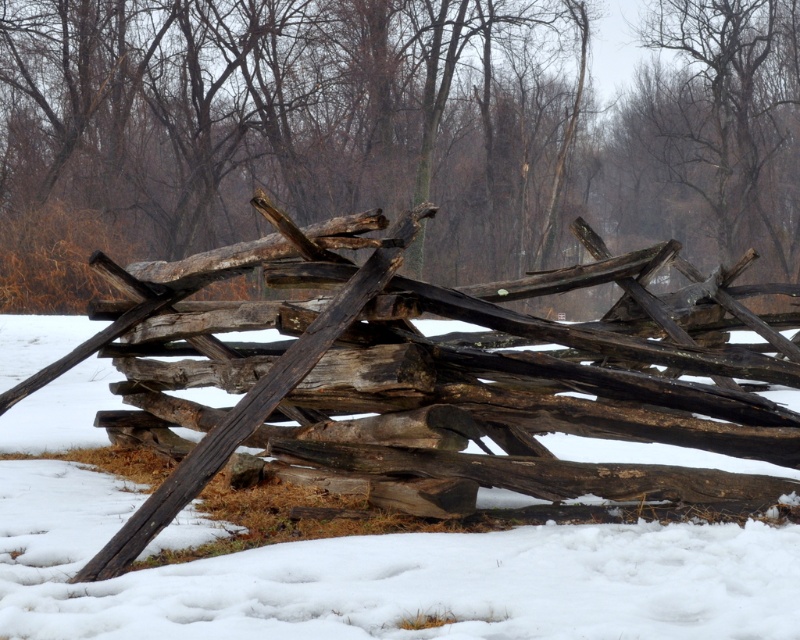
You are an outdoor photographer trying to capture the weathered wood fence at center and the white powdery snow at center in a single shot. Based on their heights, which object will appear larger in the photo?

The weathered wood fence at center will appear larger in the photo because it has a greater height compared to the white powdery snow at center.

You are an artist trying to sketch the scene. You need to decide which area to focus on first based on their sizes. Which object is wider, the white powdery snow at center or the brown textured wood at upper center?

The white powdery snow at center is wider than the brown textured wood at upper center according to the description.